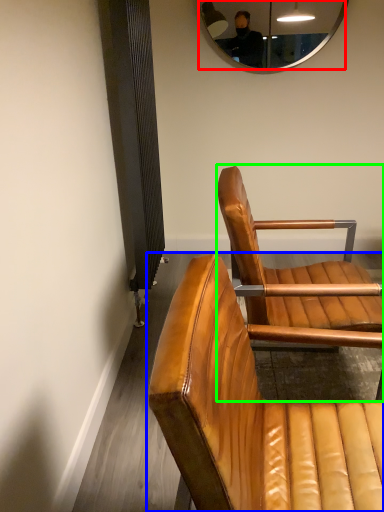
Question: Which is nearer to the mirror (highlighted by a red box)? chair (highlighted by a blue box) or chair (highlighted by a green box).

Choices:
 (A) chair
 (B) chair

Answer: (B)